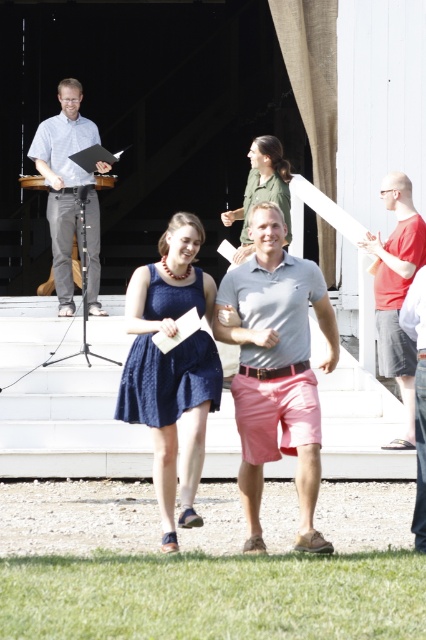
Is navy blue dress at center taller than light blue shirt at left?

In fact, navy blue dress at center may be shorter than light blue shirt at left.

Looking at this image, does navy blue dress at center appear under light blue shirt at left?

Indeed, navy blue dress at center is positioned under light blue shirt at left.

Between point (152, 467) and point (71, 147), which one is positioned in front?

Point (152, 467) is more forward.

This screenshot has width=426, height=640. What are the coordinates of `navy blue dress at center` in the screenshot? It's located at (172, 369).

Who is positioned more to the left, light blue shirt at left or matte red t-shirt at right?

From the viewer's perspective, light blue shirt at left appears more on the left side.

From the picture: Can you confirm if light blue shirt at left is wider than matte red t-shirt at right?

Yes, light blue shirt at left is wider than matte red t-shirt at right.

Between point (89, 228) and point (391, 360), which one is positioned behind?

Positioned behind is point (89, 228).

Identify the location of light blue shirt at left. The height and width of the screenshot is (640, 426). (69, 193).

Can you confirm if gray cotton polo shirt at center is bigger than matte red t-shirt at right?

Correct, gray cotton polo shirt at center is larger in size than matte red t-shirt at right.

Is gray cotton polo shirt at center above matte red t-shirt at right?

Actually, gray cotton polo shirt at center is below matte red t-shirt at right.

Which is behind, point (284, 291) or point (402, 218)?

Positioned behind is point (402, 218).

Find the location of a particular element. This screenshot has height=640, width=426. gray cotton polo shirt at center is located at coordinates (276, 369).